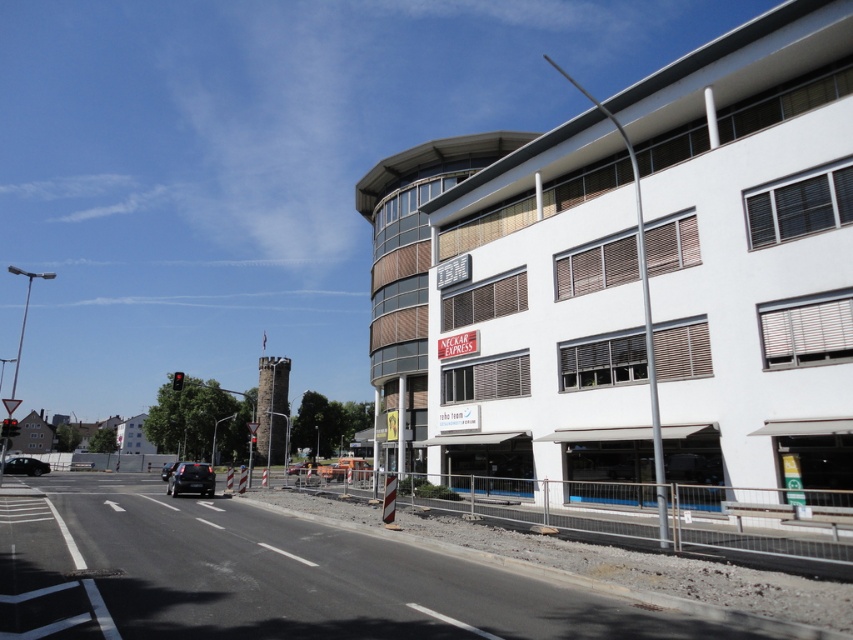
The height and width of the screenshot is (640, 853). What do you see at coordinates (25, 467) in the screenshot? I see `black glossy car at lower left` at bounding box center [25, 467].

Is point (47, 465) in front of point (169, 474)?

No.

The width and height of the screenshot is (853, 640). Find the location of `black glossy car at lower left`. black glossy car at lower left is located at coordinates (25, 467).

Between point (206, 476) and point (164, 467), which one is positioned in front?

Point (206, 476) is more forward.

At what (x,y) coordinates should I click in order to perform the action: click on shiny black car at center. Please return your answer as a coordinate pair (x, y). Looking at the image, I should click on (190, 480).

Identify the location of shiny black car at center. (190, 480).

Identify the location of shiny black car at center. (190, 480).

From the picture: Does shiny black car at center come behind black glossy car at lower left?

No.

Is point (206, 490) closer to viewer compared to point (16, 458)?

Yes.

Find the location of `shiny black car at center`. shiny black car at center is located at coordinates pos(190,480).